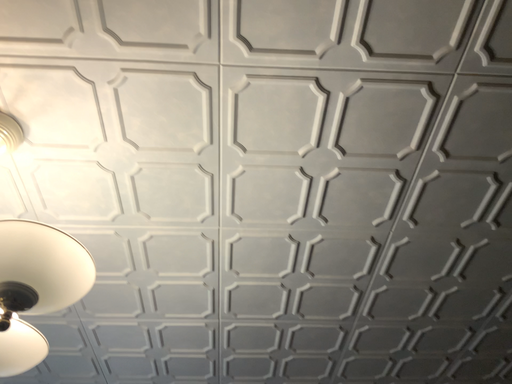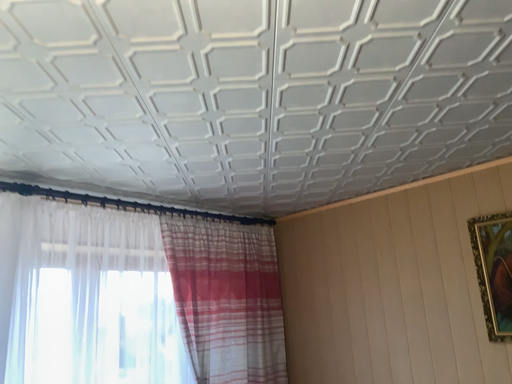
Question: How did the camera likely rotate when shooting the video?

Choices:
 (A) rotated downward
 (B) rotated upward

Answer: (A)